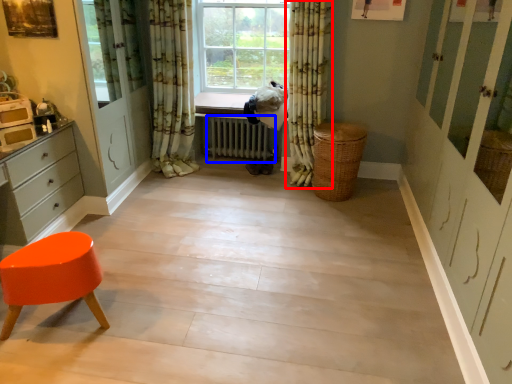
Question: Which object appears closest to the camera in this image, curtain (highlighted by a red box) or radiator (highlighted by a blue box)?

Choices:
 (A) curtain
 (B) radiator

Answer: (A)